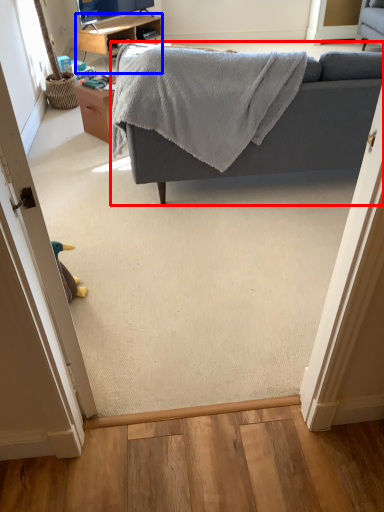
Question: Which object appears closest to the camera in this image, studio couch (highlighted by a red box) or desk (highlighted by a blue box)?

Choices:
 (A) studio couch
 (B) desk

Answer: (A)